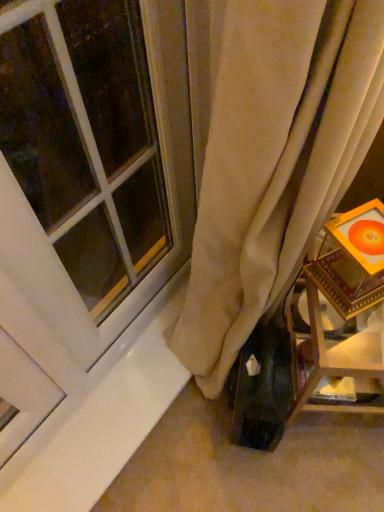
Question: Should I look upward or downward to see white glass window at upper left?

Choices:
 (A) up
 (B) down

Answer: (A)

Question: Is wooden framed picture at right outside white glass window at upper left?

Choices:
 (A) no
 (B) yes

Answer: (B)

Question: Can you confirm if wooden framed picture at right is wider than white glass window at upper left?

Choices:
 (A) yes
 (B) no

Answer: (A)

Question: Considering the relative sizes of wooden framed picture at right and white glass window at upper left in the image provided, is wooden framed picture at right bigger than white glass window at upper left?

Choices:
 (A) yes
 (B) no

Answer: (A)

Question: Is wooden framed picture at right smaller than white glass window at upper left?

Choices:
 (A) no
 (B) yes

Answer: (A)

Question: Considering the relative sizes of wooden framed picture at right and white glass window at upper left in the image provided, is wooden framed picture at right thinner than white glass window at upper left?

Choices:
 (A) no
 (B) yes

Answer: (A)

Question: From a real-world perspective, is wooden framed picture at right physically above white glass window at upper left?

Choices:
 (A) yes
 (B) no

Answer: (B)

Question: Considering the relative sizes of white glass window at upper left and wooden framed picture at right in the image provided, is white glass window at upper left smaller than wooden framed picture at right?

Choices:
 (A) yes
 (B) no

Answer: (A)

Question: Is white glass window at upper left shorter than wooden framed picture at right?

Choices:
 (A) no
 (B) yes

Answer: (A)

Question: From a real-world perspective, is white glass window at upper left located higher than wooden framed picture at right?

Choices:
 (A) no
 (B) yes

Answer: (B)

Question: Is wooden framed picture at right inside white glass window at upper left?

Choices:
 (A) yes
 (B) no

Answer: (B)

Question: Is white glass window at upper left far from wooden framed picture at right?

Choices:
 (A) yes
 (B) no

Answer: (B)

Question: Does white glass window at upper left have a greater width compared to wooden framed picture at right?

Choices:
 (A) yes
 (B) no

Answer: (B)

Question: In terms of width, does wooden framed picture at right look wider or thinner when compared to white glass window at upper left?

Choices:
 (A) thin
 (B) wide

Answer: (B)